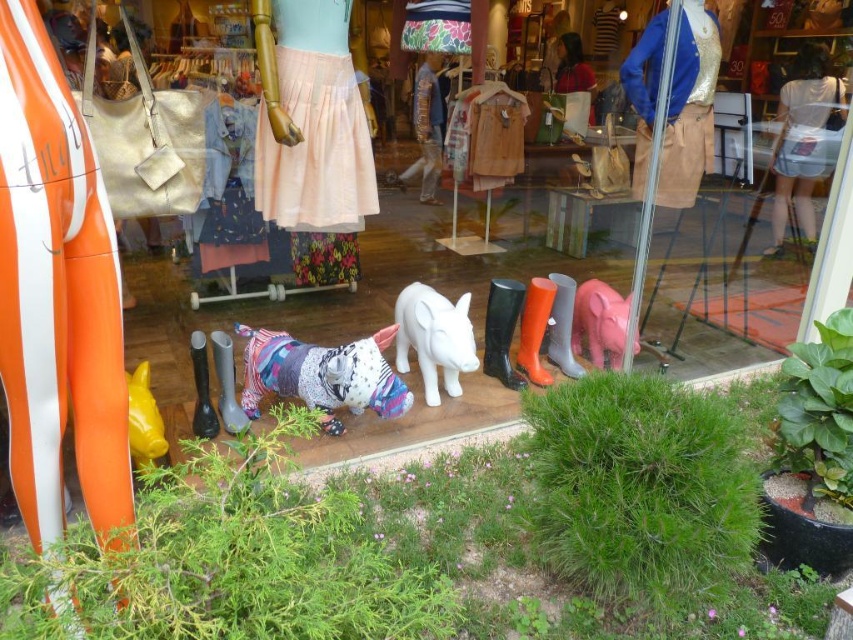
Consider the image. How much distance is there between blue sequined jacket at upper right and white cotton blouse at upper right?

blue sequined jacket at upper right is 36.01 inches away from white cotton blouse at upper right.

Which is more to the right, blue sequined jacket at upper right or white cotton blouse at upper right?

white cotton blouse at upper right

Between point (663, 17) and point (791, 106), which one is positioned behind?

The point (791, 106) is more distant.

This screenshot has width=853, height=640. I want to click on blue sequined jacket at upper right, so click(689, 108).

Consider the image. Does blue sequined jacket at upper right appear on the left side of knitted sweater at center?

Incorrect, blue sequined jacket at upper right is not on the left side of knitted sweater at center.

Is point (648, 125) positioned after point (247, 412)?

Yes, point (648, 125) is farther from viewer.

Who is more forward, (691, 60) or (282, 336)?

Point (282, 336) is more forward.

Identify the location of blue sequined jacket at upper right. The height and width of the screenshot is (640, 853). point(689,108).

Who is taller, knitted sweater at center or white cotton blouse at upper right?

Standing taller between the two is white cotton blouse at upper right.

Does knitted sweater at center lie behind white cotton blouse at upper right?

No.

Is point (379, 388) closer to camera compared to point (817, 157)?

Yes, point (379, 388) is closer to viewer.

What are the coordinates of `knitted sweater at center` in the screenshot? It's located at (322, 374).